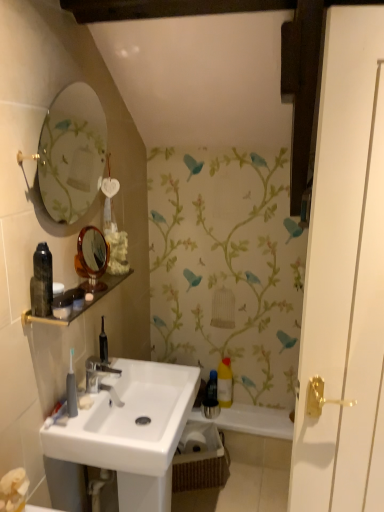
Question: Is white glossy sink at center smaller than matte black container at upper left, which is counted as the 2th toiletry, starting from the front?

Choices:
 (A) yes
 (B) no

Answer: (B)

Question: From the image's perspective, is white glossy sink at center on matte black container at upper left, arranged as the second toiletry when viewed from the top?

Choices:
 (A) yes
 (B) no

Answer: (B)

Question: Is matte black container at upper left, which is counted as the 2th toiletry, starting from the front, at the back of white glossy sink at center?

Choices:
 (A) no
 (B) yes

Answer: (A)

Question: Is the position of white glossy sink at center less distant than that of matte black container at upper left, which is counted as the second toiletry, starting from the back?

Choices:
 (A) yes
 (B) no

Answer: (B)

Question: Are white glossy sink at center and matte black container at upper left, which is counted as the second toiletry, starting from the back, making contact?

Choices:
 (A) yes
 (B) no

Answer: (B)

Question: Can matte black container at upper left, which is the 2th toiletry from bottom to top, be found inside white glossy sink at center?

Choices:
 (A) no
 (B) yes

Answer: (A)

Question: Does yellow plastic bottle at center have a greater height compared to white glossy sink at center?

Choices:
 (A) yes
 (B) no

Answer: (B)

Question: Can you see yellow plastic bottle at center touching white glossy sink at center?

Choices:
 (A) yes
 (B) no

Answer: (B)

Question: Is yellow plastic bottle at center to the left of white glossy sink at center from the viewer's perspective?

Choices:
 (A) yes
 (B) no

Answer: (B)

Question: From the image's perspective, is yellow plastic bottle at center on white glossy sink at center?

Choices:
 (A) no
 (B) yes

Answer: (B)

Question: Considering the relative sizes of yellow plastic bottle at center and white glossy sink at center in the image provided, is yellow plastic bottle at center smaller than white glossy sink at center?

Choices:
 (A) no
 (B) yes

Answer: (B)

Question: Is yellow plastic bottle at center positioned behind white glossy sink at center?

Choices:
 (A) no
 (B) yes

Answer: (B)

Question: Is silver metallic faucet at center turned away from white glossy door at right?

Choices:
 (A) no
 (B) yes

Answer: (A)